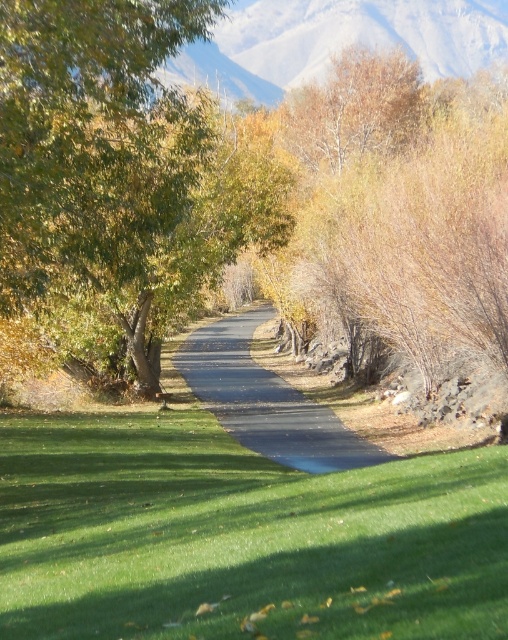
Is smooth gray mountain at upper center below black asphalt road at center?

Actually, smooth gray mountain at upper center is above black asphalt road at center.

Can you confirm if smooth gray mountain at upper center is bigger than black asphalt road at center?

Indeed, smooth gray mountain at upper center has a larger size compared to black asphalt road at center.

Consider the image. Measure the distance between smooth gray mountain at upper center and camera.

smooth gray mountain at upper center and camera are 13.97 meters apart.

Locate an element on the screen. smooth gray mountain at upper center is located at coordinates (337, 40).

Who is positioned more to the right, green grass at center or smooth gray mountain at upper center?

From the viewer's perspective, smooth gray mountain at upper center appears more on the right side.

Is green grass at center to the right of smooth gray mountain at upper center from the viewer's perspective?

In fact, green grass at center is to the left of smooth gray mountain at upper center.

The height and width of the screenshot is (640, 508). Describe the element at coordinates (239, 536) in the screenshot. I see `green grass at center` at that location.

Find the location of a particular element. This screenshot has height=640, width=508. green grass at center is located at coordinates (239, 536).

Who is shorter, green leafy tree at left or smooth gray mountain at upper center?

→ green leafy tree at left

Does point (115, 214) come closer to viewer compared to point (237, 13)?

Yes.

Who is more distant from viewer, [112,241] or [300,44]?

Point [300,44]

Find the location of a particular element. The width and height of the screenshot is (508, 640). green leafy tree at left is located at coordinates (117, 173).